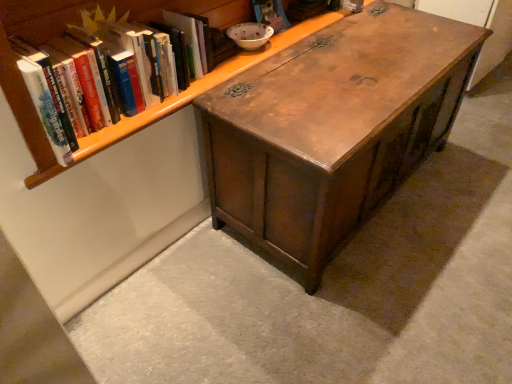
Question: Does hardcover book at upper left have a greater width compared to wooden chest at center?

Choices:
 (A) yes
 (B) no

Answer: (B)

Question: Is hardcover book at upper left aimed at wooden chest at center?

Choices:
 (A) yes
 (B) no

Answer: (B)

Question: Can we say hardcover book at upper left lies outside wooden chest at center?

Choices:
 (A) yes
 (B) no

Answer: (A)

Question: From the image's perspective, is hardcover book at upper left on wooden chest at center?

Choices:
 (A) yes
 (B) no

Answer: (A)

Question: Can you confirm if hardcover book at upper left is bigger than wooden chest at center?

Choices:
 (A) yes
 (B) no

Answer: (B)

Question: Does point (16, 84) appear closer or farther from the camera than point (223, 148)?

Choices:
 (A) closer
 (B) farther

Answer: (A)

Question: From a real-world perspective, relative to wooden chest at center, is wooden bookshelf at upper left vertically above or below?

Choices:
 (A) below
 (B) above

Answer: (B)

Question: From the image's perspective, relative to wooden chest at center, is wooden bookshelf at upper left above or below?

Choices:
 (A) above
 (B) below

Answer: (A)

Question: Is wooden bookshelf at upper left taller or shorter than wooden chest at center?

Choices:
 (A) tall
 (B) short

Answer: (B)

Question: From the image's perspective, is hardcover book at upper left above or below wooden chest at center?

Choices:
 (A) below
 (B) above

Answer: (B)

Question: From a real-world perspective, relative to wooden chest at center, is hardcover book at upper left vertically above or below?

Choices:
 (A) below
 (B) above

Answer: (B)

Question: Is hardcover book at upper left wider or thinner than wooden chest at center?

Choices:
 (A) wide
 (B) thin

Answer: (B)

Question: In the image, is hardcover book at upper left positioned in front of or behind wooden chest at center?

Choices:
 (A) front
 (B) behind

Answer: (A)

Question: From the image's perspective, is wooden bookshelf at upper left above or below hardcover book at upper left?

Choices:
 (A) above
 (B) below

Answer: (A)

Question: From their relative heights in the image, would you say wooden bookshelf at upper left is taller or shorter than hardcover book at upper left?

Choices:
 (A) tall
 (B) short

Answer: (A)